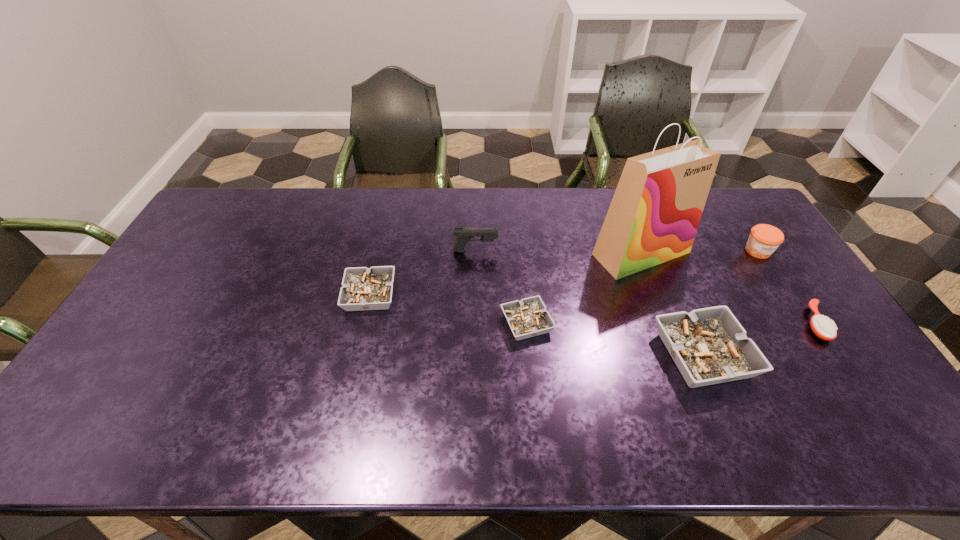
Where is `hairbrush`? hairbrush is located at coordinates pyautogui.click(x=824, y=328).

At what (x,y) coordinates should I click in order to perform the action: click on vacant space located on the left of the leftmost ashtray. Please return your answer as a coordinate pair (x, y). Looking at the image, I should click on (216, 295).

Where is `free space located 0.160m on the right of the second ashtray from right to left`? Image resolution: width=960 pixels, height=540 pixels. free space located 0.160m on the right of the second ashtray from right to left is located at coordinates (610, 323).

The width and height of the screenshot is (960, 540). What are the coordinates of `vacant space located on the back of the fourth tallest object` in the screenshot? It's located at [x=660, y=253].

The width and height of the screenshot is (960, 540). In order to click on vacant region located 0.140m on the front label of the third tallest object in this screenshot , I will do `click(785, 294)`.

Locate an element on the screen. This screenshot has width=960, height=540. free space located on the left of the shopping bag is located at coordinates (488, 253).

The image size is (960, 540). In order to click on free space located at the barrel of the pistol in this screenshot , I will do `click(588, 251)`.

Find the location of a particular element. This screenshot has width=960, height=540. vacant space located on the back of the hairbrush is located at coordinates pyautogui.click(x=794, y=292).

At what (x,y) coordinates should I click in order to perform the action: click on object present at the near edge. Please return your answer as a coordinate pair (x, y). Looking at the image, I should click on (709, 346).

Identify the location of jam at the right edge. (764, 239).